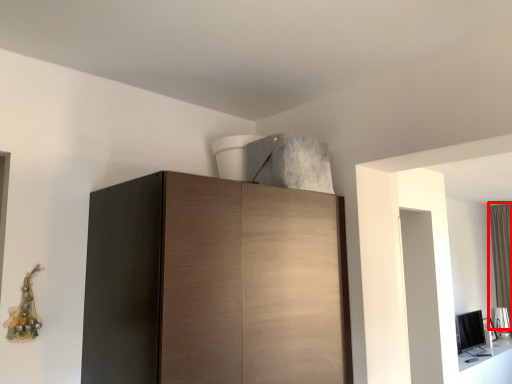
Question: From the image, what is the correct spatial relationship of curtain (annotated by the red box) in relation to cupboard?

Choices:
 (A) left
 (B) right

Answer: (B)